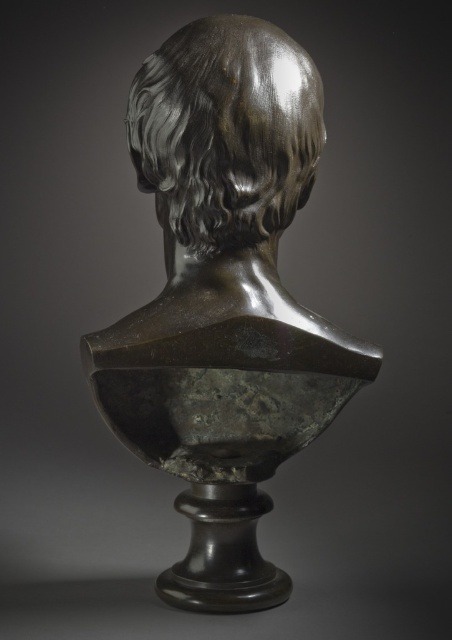
Question: Which object appears closest to the camera in this image?

Choices:
 (A) bronze bust at center
 (B) shiny bronze head at center

Answer: (B)

Question: Is the position of bronze bust at center more distant than that of shiny bronze head at center?

Choices:
 (A) yes
 (B) no

Answer: (A)

Question: Does bronze bust at center have a larger size compared to shiny bronze head at center?

Choices:
 (A) yes
 (B) no

Answer: (A)

Question: Does bronze bust at center come behind shiny bronze head at center?

Choices:
 (A) yes
 (B) no

Answer: (A)

Question: Which of the following is the closest to the observer?

Choices:
 (A) shiny bronze head at center
 (B) bronze bust at center

Answer: (A)